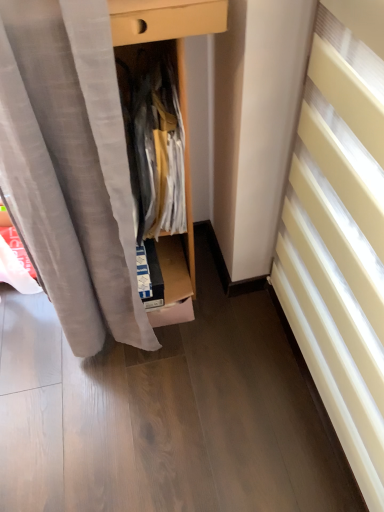
Question: From the image's perspective, relative to white textured radiator at right, is white cotton shirt at center above or below?

Choices:
 (A) above
 (B) below

Answer: (A)

Question: Is point (139, 218) closer or farther from the camera than point (321, 156)?

Choices:
 (A) closer
 (B) farther

Answer: (B)

Question: Which is correct: white cotton shirt at center is inside white textured radiator at right, or outside of it?

Choices:
 (A) outside
 (B) inside

Answer: (A)

Question: From a real-world perspective, is white textured radiator at right physically located above or below white cotton shirt at center?

Choices:
 (A) above
 (B) below

Answer: (B)

Question: Considering their positions, is white textured radiator at right located in front of or behind white cotton shirt at center?

Choices:
 (A) behind
 (B) front

Answer: (B)

Question: Is white textured radiator at right spatially inside white cotton shirt at center, or outside of it?

Choices:
 (A) inside
 (B) outside

Answer: (B)

Question: Based on their positions, is white textured radiator at right located to the left or right of white cotton shirt at center?

Choices:
 (A) left
 (B) right

Answer: (B)